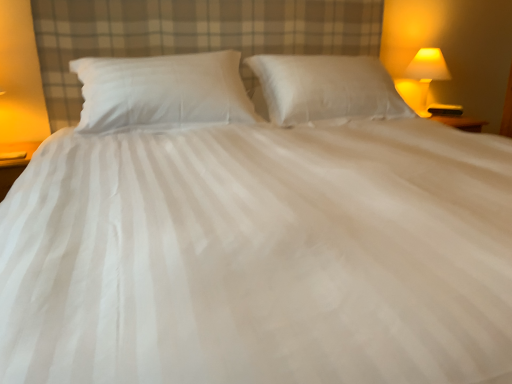
Question: Considering the relative sizes of white cotton pillow at center, the 2th pillow from the right, and matte yellow glass lamp at upper right in the image provided, is white cotton pillow at center, the 2th pillow from the right, wider than matte yellow glass lamp at upper right?

Choices:
 (A) no
 (B) yes

Answer: (B)

Question: From the image's perspective, is white cotton pillow at center, the 1th pillow when ordered from left to right, over matte yellow glass lamp at upper right?

Choices:
 (A) yes
 (B) no

Answer: (B)

Question: Considering the relative positions of white cotton pillow at center, the 2th pillow from the right, and matte yellow glass lamp at upper right in the image provided, is white cotton pillow at center, the 2th pillow from the right, to the right of matte yellow glass lamp at upper right from the viewer's perspective?

Choices:
 (A) no
 (B) yes

Answer: (A)

Question: Is white cotton pillow at center, the 2th pillow from the right, positioned in front of matte yellow glass lamp at upper right?

Choices:
 (A) no
 (B) yes

Answer: (B)

Question: From the image's perspective, is white cotton pillow at center, the 1th pillow when ordered from left to right, below matte yellow glass lamp at upper right?

Choices:
 (A) no
 (B) yes

Answer: (B)

Question: Does white cotton pillow at center, the 1th pillow when ordered from left to right, come behind matte yellow glass lamp at upper right?

Choices:
 (A) no
 (B) yes

Answer: (A)

Question: From a real-world perspective, is white cotton pillow at center, the 2th pillow from the right, located higher than white soft pillow at center, the 1th pillow in the right-to-left sequence?

Choices:
 (A) no
 (B) yes

Answer: (B)

Question: Is white cotton pillow at center, the 2th pillow from the right, placed right next to white soft pillow at center, the 1th pillow in the right-to-left sequence?

Choices:
 (A) no
 (B) yes

Answer: (A)

Question: Can you confirm if white cotton pillow at center, the 1th pillow when ordered from left to right, is thinner than white soft pillow at center, the 1th pillow in the right-to-left sequence?

Choices:
 (A) no
 (B) yes

Answer: (A)

Question: From the image's perspective, is white cotton pillow at center, the 2th pillow from the right, beneath white soft pillow at center, the 1th pillow in the right-to-left sequence?

Choices:
 (A) yes
 (B) no

Answer: (A)

Question: Considering the relative sizes of white cotton pillow at center, the 1th pillow when ordered from left to right, and white soft pillow at center, the 1th pillow in the right-to-left sequence, in the image provided, is white cotton pillow at center, the 1th pillow when ordered from left to right, taller than white soft pillow at center, the 1th pillow in the right-to-left sequence,?

Choices:
 (A) no
 (B) yes

Answer: (A)

Question: Is white cotton pillow at center, the 2th pillow from the right, far from white soft pillow at center, the 1th pillow in the right-to-left sequence?

Choices:
 (A) yes
 (B) no

Answer: (B)

Question: Is white cotton pillow at center, the 1th pillow when ordered from left to right, at the back of white soft pillow at center, which appears as the second pillow when viewed from the left?

Choices:
 (A) no
 (B) yes

Answer: (A)